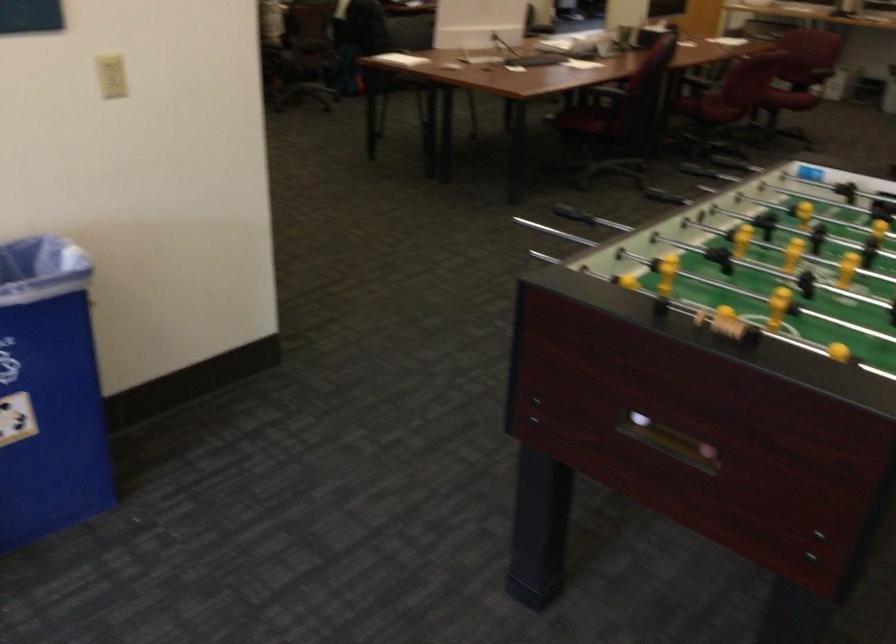
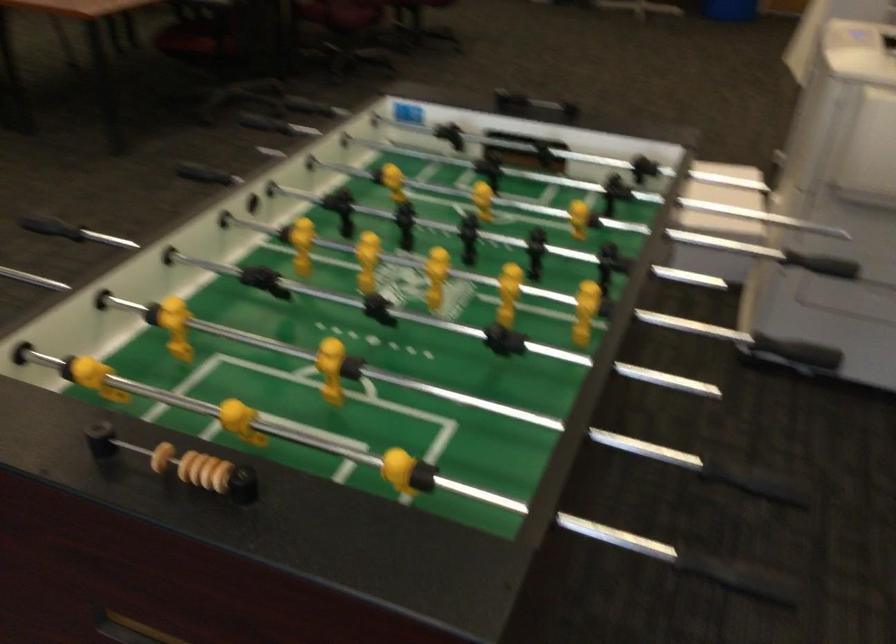
Locate, in the second image, the point that corresponds to the point at 702,315 in the first image.

(161, 457)